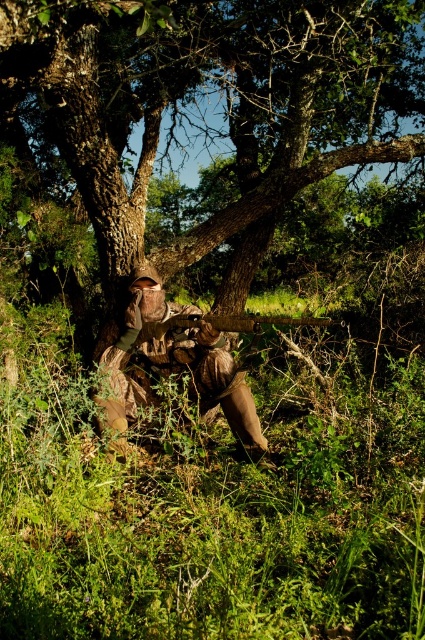
You are a hunter in the forest and have two rifles at the center. Which one is taller, the camouflage fabric rifle at center or the wooden rifle at center?

The camouflage fabric rifle at center is taller than the wooden rifle at center.